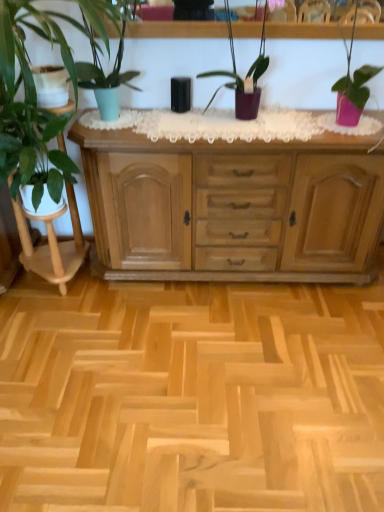
Where is `free space between natural wood cabinet at center and white glossy plant stand at left`? This screenshot has width=384, height=512. free space between natural wood cabinet at center and white glossy plant stand at left is located at coordinates (191, 291).